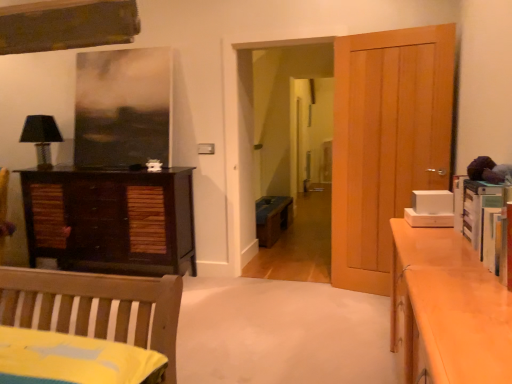
Question: From a real-world perspective, is dark wood cabinet at left positioned over light brown wooden door at right based on gravity?

Choices:
 (A) no
 (B) yes

Answer: (A)

Question: Is dark wood cabinet at left aimed at light brown wooden door at right?

Choices:
 (A) no
 (B) yes

Answer: (A)

Question: Is dark wood cabinet at left thinner than light brown wooden door at right?

Choices:
 (A) yes
 (B) no

Answer: (B)

Question: From the image's perspective, is dark wood cabinet at left beneath light brown wooden door at right?

Choices:
 (A) yes
 (B) no

Answer: (A)

Question: Is dark wood cabinet at left beside light brown wooden door at right?

Choices:
 (A) no
 (B) yes

Answer: (A)

Question: Is dark wood cabinet at left positioned before light brown wooden door at right?

Choices:
 (A) no
 (B) yes

Answer: (A)

Question: Considering the relative sizes of dark wood cabinet at left and black fabric lampshade at left in the image provided, is dark wood cabinet at left taller than black fabric lampshade at left?

Choices:
 (A) yes
 (B) no

Answer: (A)

Question: From a real-world perspective, does dark wood cabinet at left sit lower than black fabric lampshade at left?

Choices:
 (A) no
 (B) yes

Answer: (B)

Question: Could you tell me if dark wood cabinet at left is facing black fabric lampshade at left?

Choices:
 (A) yes
 (B) no

Answer: (B)

Question: Is dark wood cabinet at left positioned with its back to black fabric lampshade at left?

Choices:
 (A) no
 (B) yes

Answer: (A)

Question: From the image's perspective, would you say dark wood cabinet at left is shown under black fabric lampshade at left?

Choices:
 (A) no
 (B) yes

Answer: (B)

Question: Would you say dark wood cabinet at left contains black fabric lampshade at left?

Choices:
 (A) yes
 (B) no

Answer: (B)

Question: From the image's perspective, would you say black fabric lampshade at left is positioned over dark wood cabinet at left?

Choices:
 (A) no
 (B) yes

Answer: (B)